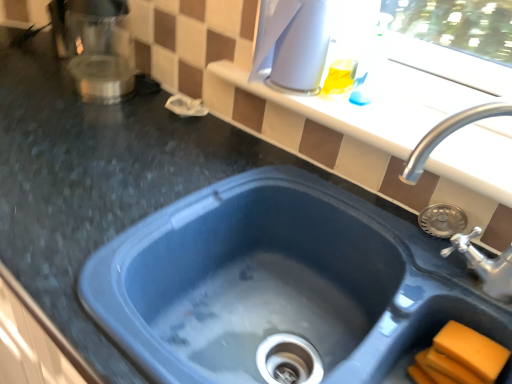
This screenshot has width=512, height=384. Identify the location of empty space that is ontop of white glossy window sill at upper center (from a real-world perspective). (385, 115).